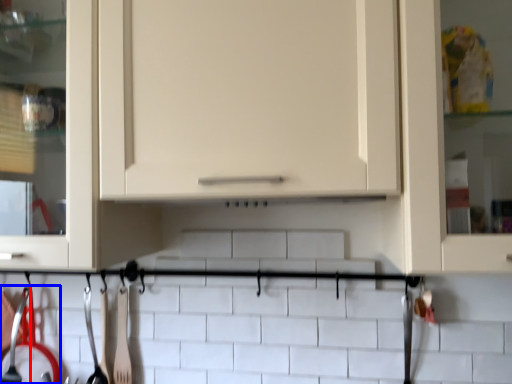
Question: Which object is further to the camera taking this photo, silverware (highlighted by a red box) or silverware (highlighted by a blue box)?

Choices:
 (A) silverware
 (B) silverware

Answer: (A)